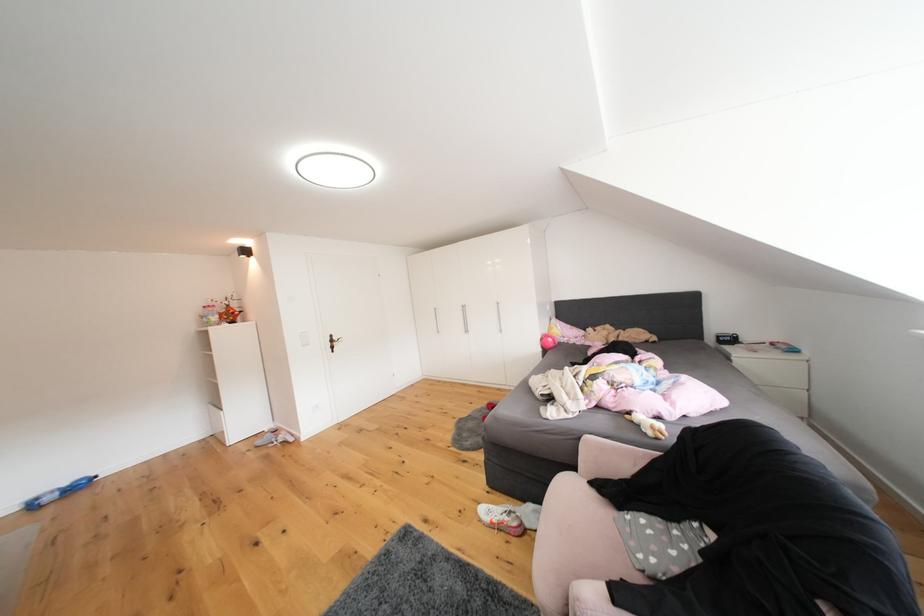
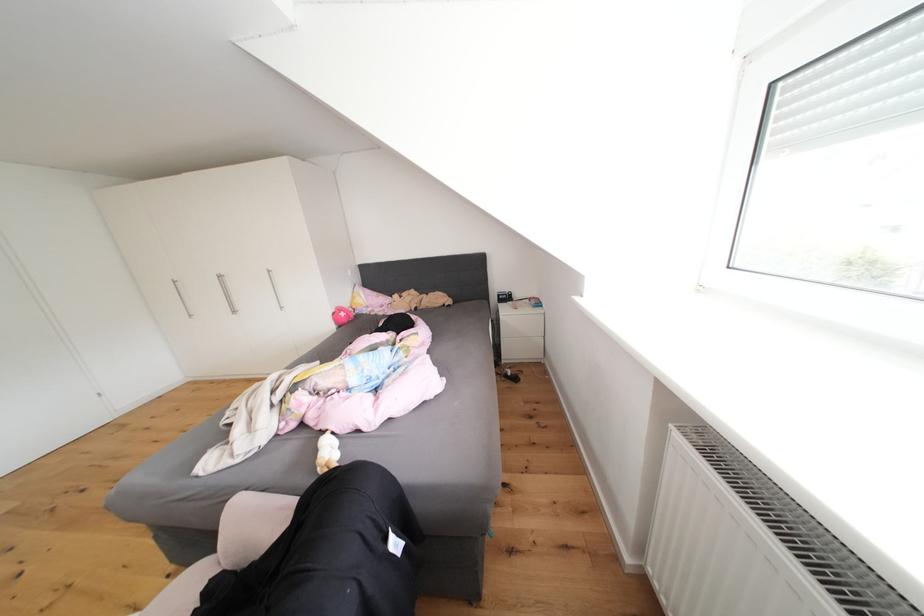
Question: The images are taken continuously from a first-person perspective. In which direction are you moving?

Choices:
 (A) Left
 (B) Right
 (C) Forward
 (D) Backward

Answer: (B)